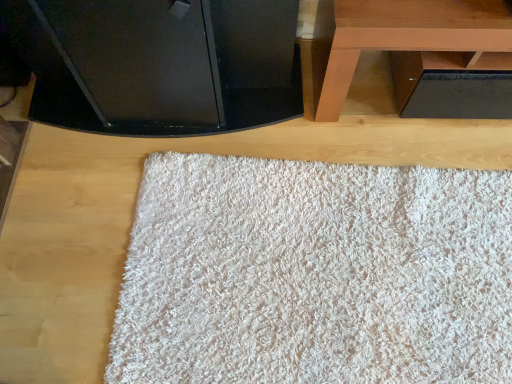
Question: Looking at the image, does brown wooden table at upper right seem bigger or smaller compared to black glossy tv at upper center?

Choices:
 (A) big
 (B) small

Answer: (B)

Question: Is brown wooden table at upper right wider or thinner than black glossy tv at upper center?

Choices:
 (A) wide
 (B) thin

Answer: (B)

Question: Which object is positioned closest to the brown wooden table at upper right?

Choices:
 (A) black glossy tv at upper center
 (B) white fluffy rug at center

Answer: (A)

Question: Which of these objects is positioned closest to the black glossy tv at upper center?

Choices:
 (A) white fluffy rug at center
 (B) brown wooden table at upper right

Answer: (B)